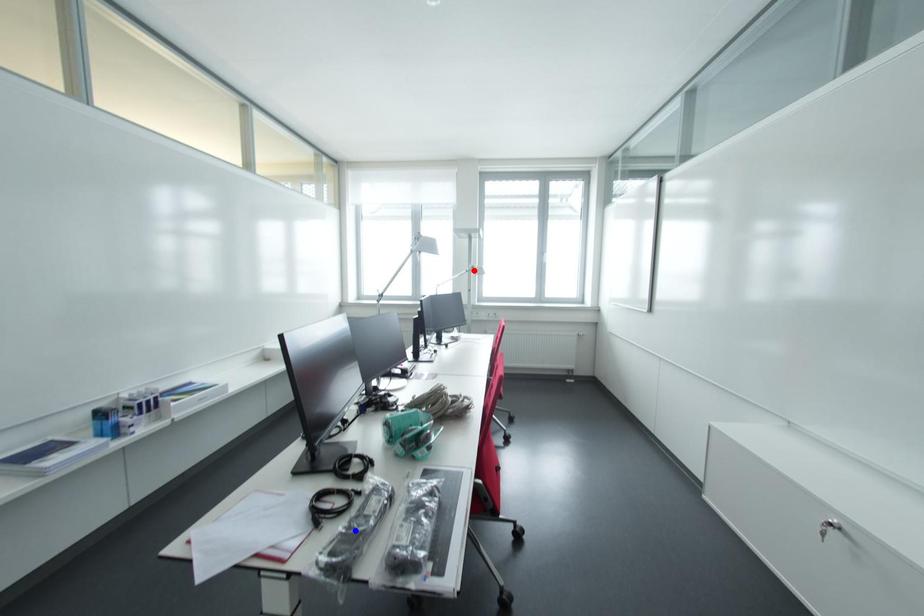
Question: In the image, two points are highlighted. Which point is nearer to the camera? Reply with the corresponding letter.

Choices:
 (A) blue point
 (B) red point

Answer: (A)